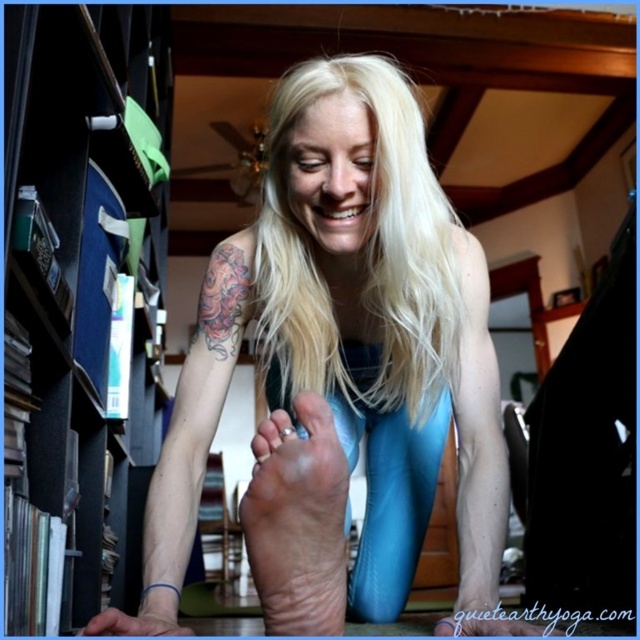
Question: Considering the relative positions of black cardboard bookshelf at left and blue leather foot at lower center in the image provided, where is black cardboard bookshelf at left located with respect to blue leather foot at lower center?

Choices:
 (A) below
 (B) above

Answer: (B)

Question: Can you confirm if dry skin foot at lower center is positioned to the left of colorful ink tattoo at upper left?

Choices:
 (A) yes
 (B) no

Answer: (B)

Question: Which point is closer to the camera?

Choices:
 (A) (252, 291)
 (B) (449, 620)

Answer: (B)

Question: Does blue shiny leggings at center have a greater width compared to black cardboard bookshelf at left?

Choices:
 (A) yes
 (B) no

Answer: (A)

Question: Which of the following is the farthest from the observer?

Choices:
 (A) colorful ink tattoo at upper left
 (B) matte blue toe at lower center
 (C) dry skin foot at lower center

Answer: (A)

Question: Which object is closer to the camera taking this photo?

Choices:
 (A) black cardboard bookshelf at left
 (B) blue shiny leggings at center
 (C) matte blue toe at lower center

Answer: (B)